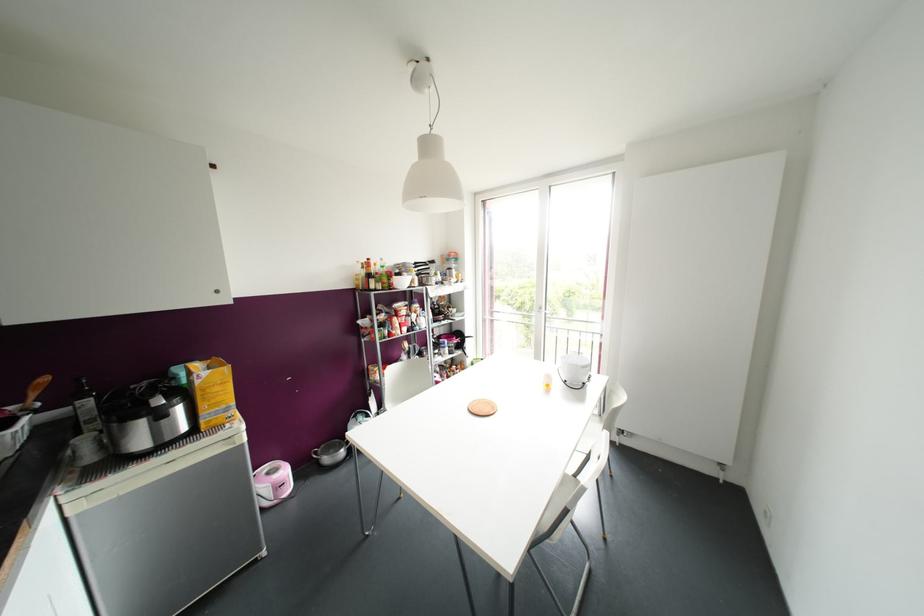
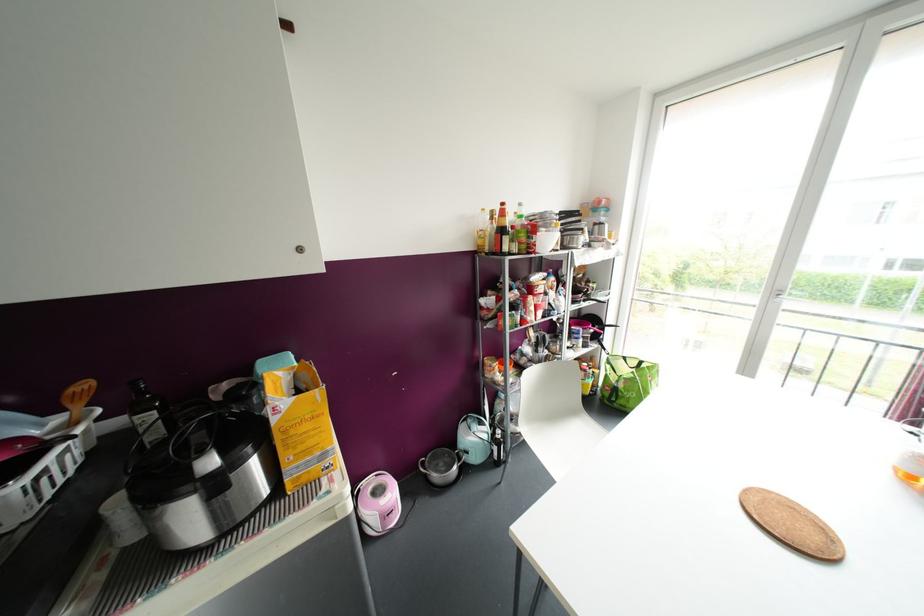
Locate, in the second image, the point that corresponds to (87,402) in the first image.

(150, 416)